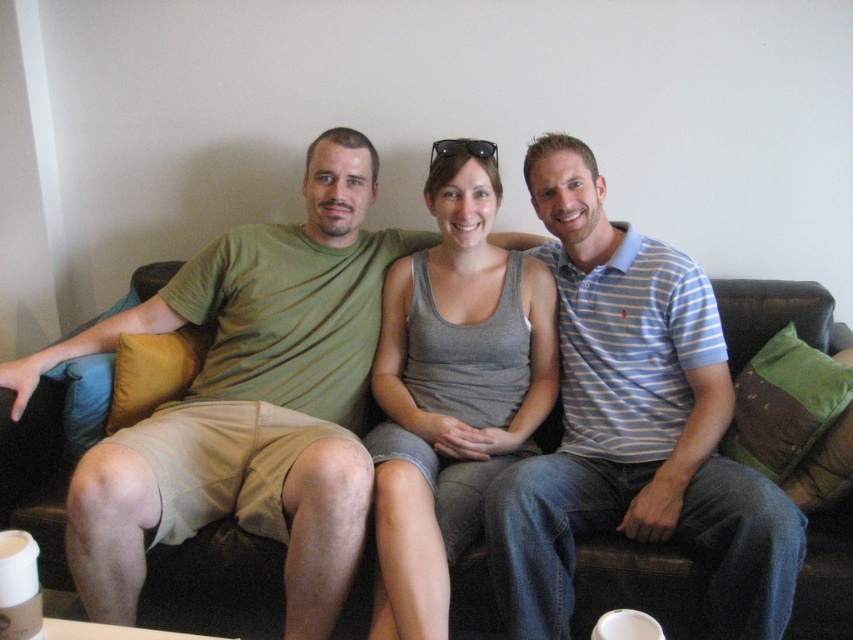
Based on the photo, you are standing in front of the couch where three people are sitting. You want to place a small gift box at the exact point marked as point (433,502). Considering the distance from where you are standing to this point is 5.22 feet, can you estimate whether the gift box will be placed closer to the left side or the right side of the couch?

The point (433,502) is located closer to the right side of the couch because the distance from the camera to this point is 5.22 feet, indicating its position relative to the couch.

You are standing in front of the couch where the three people are sitting. You want to place a small decorative item exactly at the point labeled as point (711, 602). If you are 2 meters away from the couch, will you be able to reach the point without moving closer?

The point (711, 602) is 1.50 meters away from the camera. Since you are 2 meters away from the couch, you are farther than the required distance. Therefore, you cannot reach the point without moving closer.